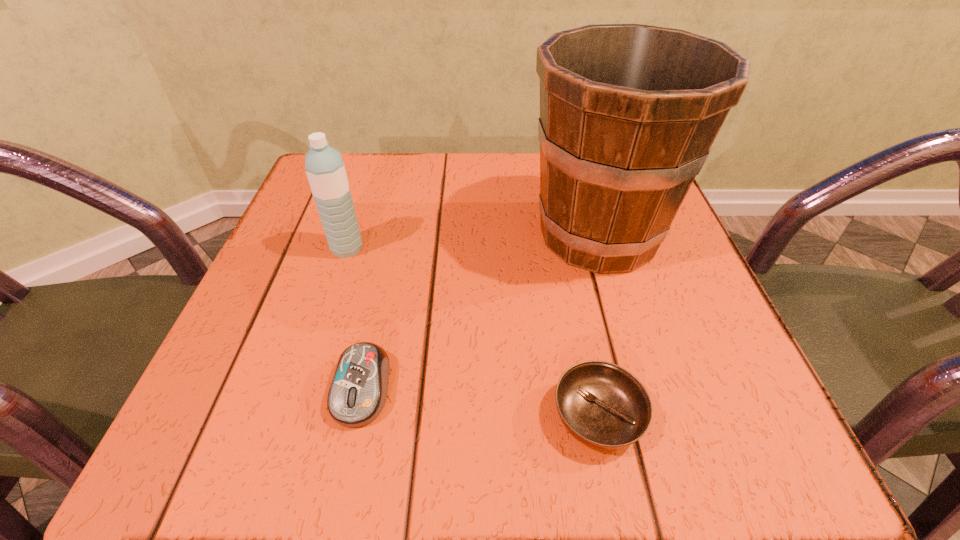
At what (x,y) coordinates should I click in order to perform the action: click on the tallest object. Please return your answer as a coordinate pair (x, y). Looking at the image, I should click on (628, 112).

Where is `the leftmost object`? The width and height of the screenshot is (960, 540). the leftmost object is located at coordinates (324, 165).

Identify the location of water bottle. This screenshot has width=960, height=540. (324, 165).

At what (x,y) coordinates should I click in order to perform the action: click on the third object from right to left. Please return your answer as a coordinate pair (x, y). The height and width of the screenshot is (540, 960). Looking at the image, I should click on (358, 392).

Find the location of a particular element. soup bowl is located at coordinates (602, 405).

The width and height of the screenshot is (960, 540). In order to click on vacant space situated on the left of the bucket in this screenshot , I will do `click(480, 235)`.

Where is `free region located 0.080m on the right of the leftmost object`? This screenshot has height=540, width=960. free region located 0.080m on the right of the leftmost object is located at coordinates (408, 248).

Locate an element on the screen. The image size is (960, 540). vacant space located 0.100m on the right of the soup bowl is located at coordinates (720, 416).

Locate an element on the screen. object situated at the far edge is located at coordinates (628, 112).

The width and height of the screenshot is (960, 540). I want to click on computer mouse that is positioned at the near edge, so click(358, 392).